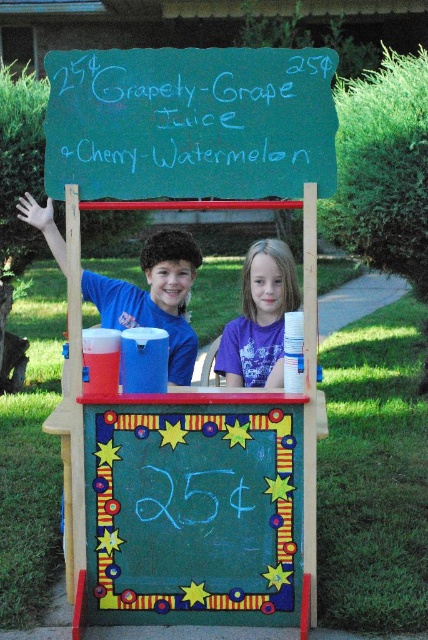
Question: From the image, what is the correct spatial relationship of green chalkboard at upper center in relation to purple cotton shirt at center?

Choices:
 (A) below
 (B) above

Answer: (B)

Question: Can you confirm if blue t-shirt at left is positioned below purple cotton shirt at center?

Choices:
 (A) yes
 (B) no

Answer: (B)

Question: Which of the following is the closest to the observer?

Choices:
 (A) (x=293, y=429)
 (B) (x=163, y=304)
 (C) (x=261, y=141)

Answer: (C)

Question: Which object is the farthest from the blue t-shirt at left?

Choices:
 (A) green chalkboard at upper center
 (B) purple cotton shirt at center

Answer: (A)

Question: Which of the following is the farthest from the observer?

Choices:
 (A) decorative chalkboard at center
 (B) blue t-shirt at left

Answer: (B)

Question: Does blue t-shirt at left have a lesser width compared to purple cotton shirt at center?

Choices:
 (A) yes
 (B) no

Answer: (B)